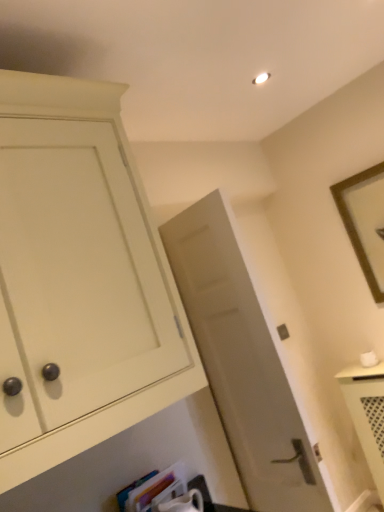
Question: In terms of width, does brown wooden picture frame at upper right look wider or thinner when compared to hardcover book at lower center?

Choices:
 (A) wide
 (B) thin

Answer: (B)

Question: From their relative heights in the image, would you say brown wooden picture frame at upper right is taller or shorter than hardcover book at lower center?

Choices:
 (A) tall
 (B) short

Answer: (A)

Question: Estimate the real-world distances between objects in this image. Which object is closer to the matte white cabinet at left?

Choices:
 (A) brown wooden picture frame at upper right
 (B) matte gray door at center
 (C) hardcover book at lower center

Answer: (B)

Question: Which object is positioned closest to the brown wooden picture frame at upper right?

Choices:
 (A) matte white cabinet at left
 (B) hardcover book at lower center
 (C) matte gray door at center

Answer: (C)